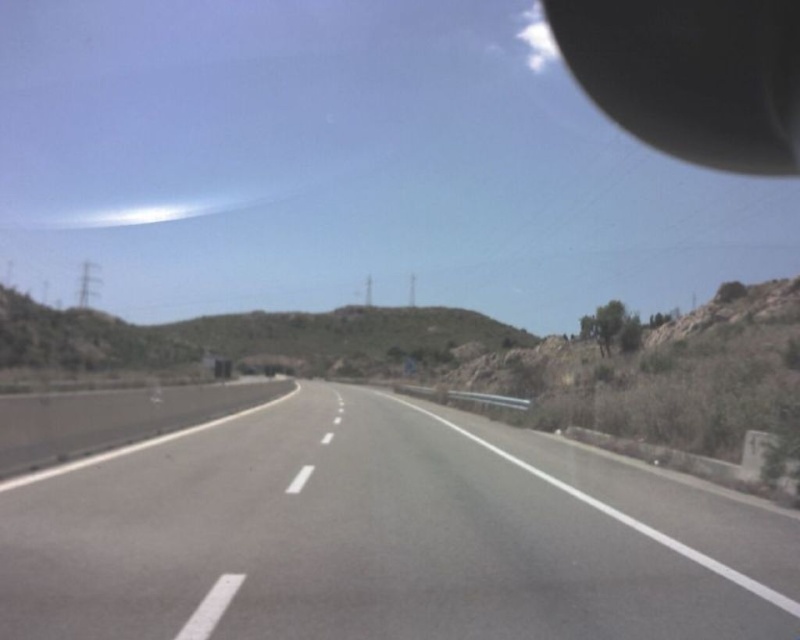
Question: Where is smooth asphalt highway at center located in relation to black matte rearview mirror at upper right in the image?

Choices:
 (A) right
 (B) left

Answer: (B)

Question: Which of the following is the closest to the observer?

Choices:
 (A) smooth asphalt highway at center
 (B) black matte rearview mirror at upper right

Answer: (A)

Question: Is smooth asphalt highway at center bigger than black matte rearview mirror at upper right?

Choices:
 (A) yes
 (B) no

Answer: (B)

Question: Can you confirm if smooth asphalt highway at center is wider than black matte rearview mirror at upper right?

Choices:
 (A) no
 (B) yes

Answer: (A)